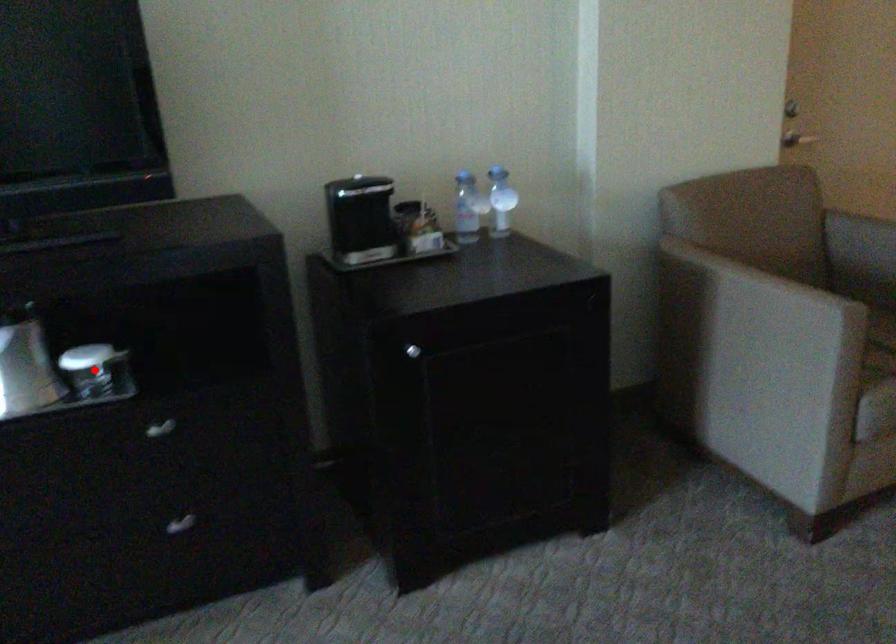
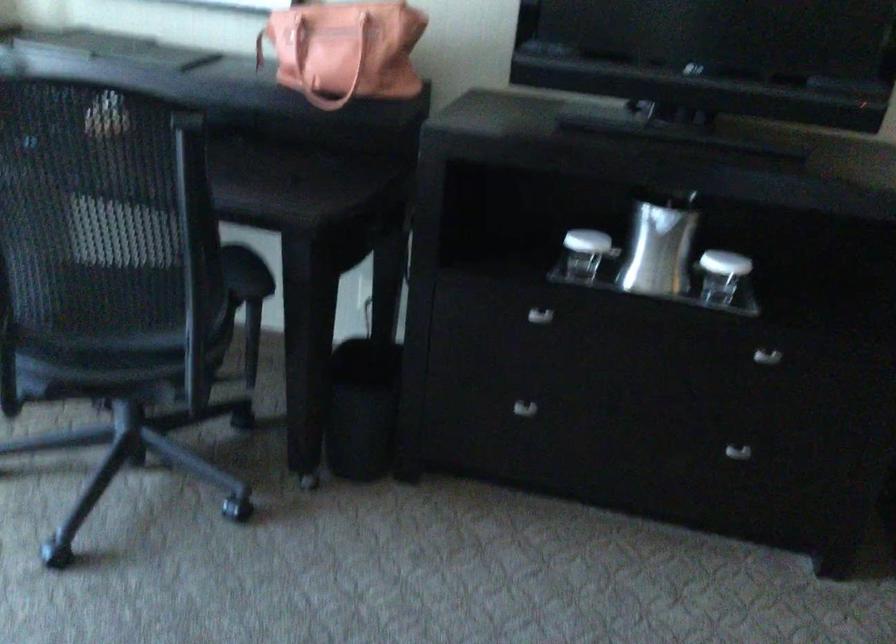
Find the pixel in the second image that matches the highlighted location in the first image.

(721, 275)